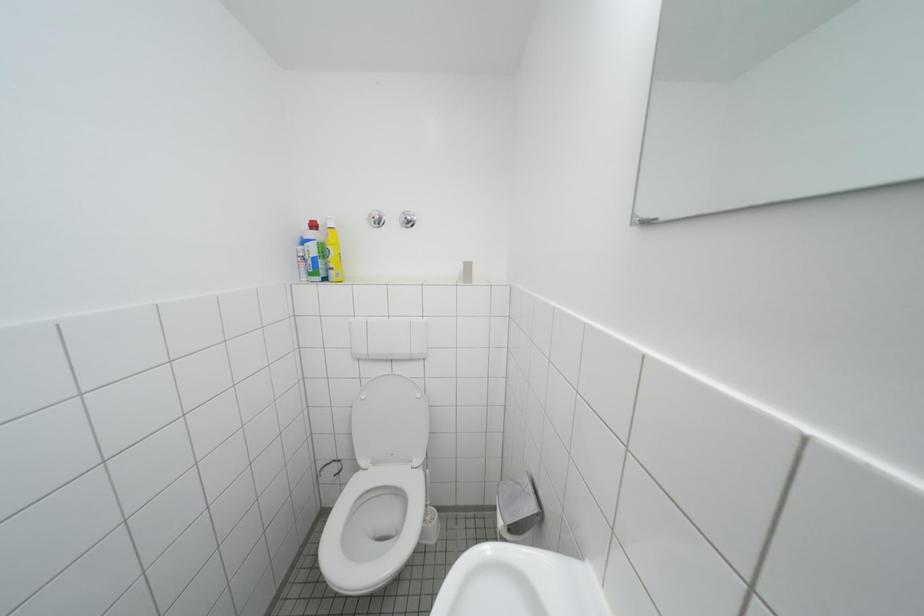
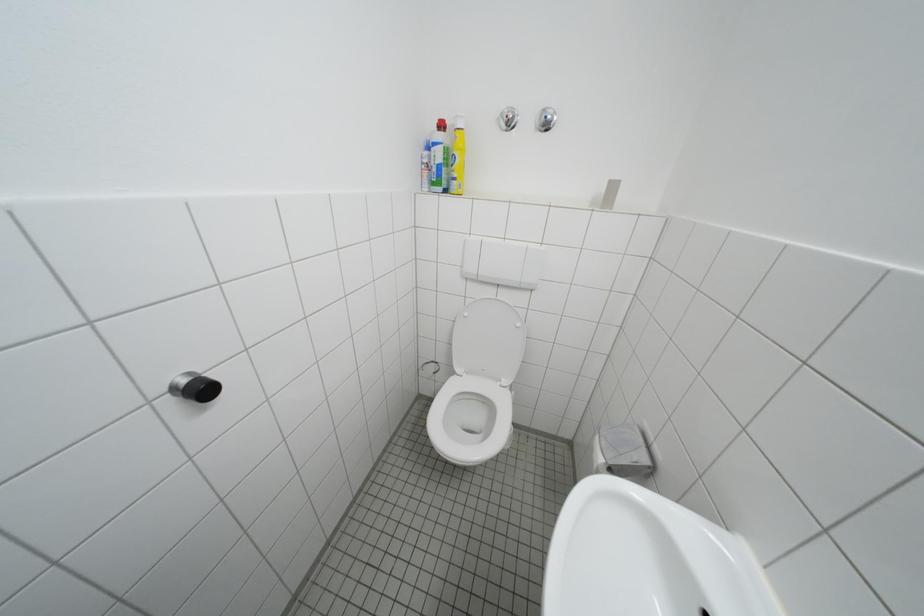
First-person continuous shooting, in which direction is the camera rotating?

The rotation direction of the camera is left-down.